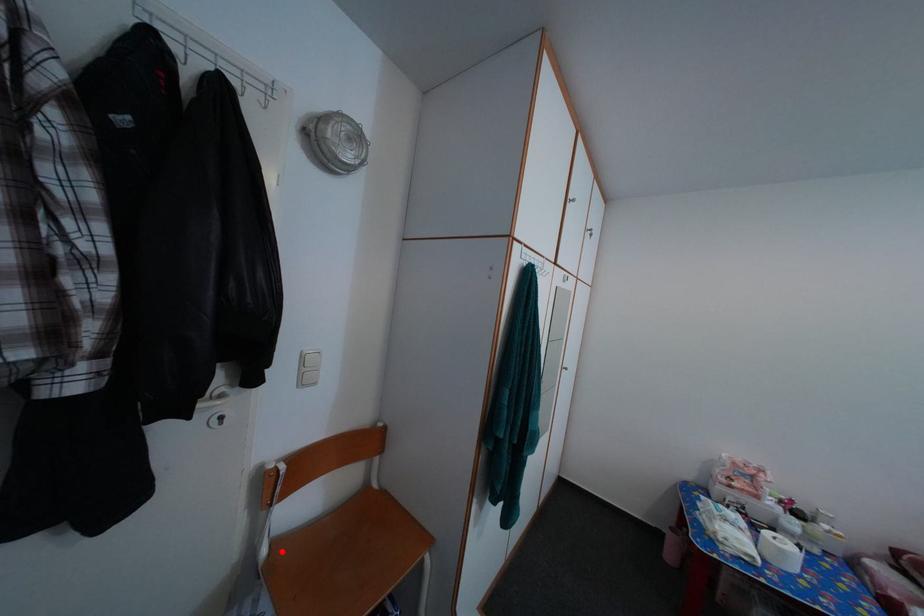
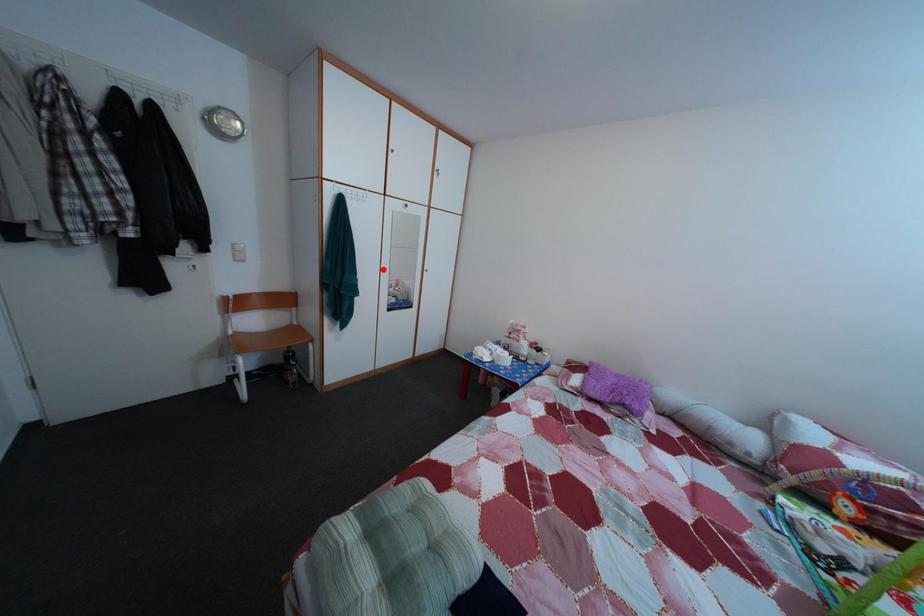
I am providing you with two images of the same scene from different viewpoints. A red point is marked on the first image and another point is marked on the second image. Do the highlighted points in image1 and image2 indicate the same real-world spot?

No